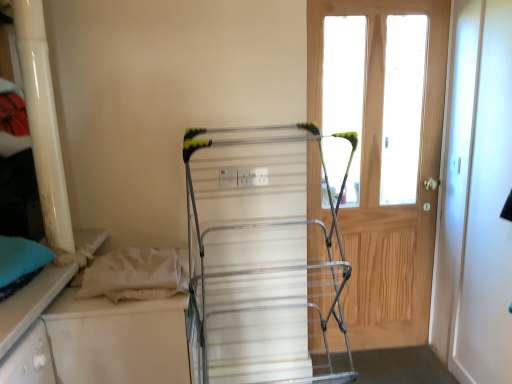
Question: Is light brown wooden door at right in front of or behind silver metallic drying rack at center in the image?

Choices:
 (A) behind
 (B) front

Answer: (A)

Question: Considering the positions of light brown wooden door at right and silver metallic drying rack at center in the image, is light brown wooden door at right taller or shorter than silver metallic drying rack at center?

Choices:
 (A) short
 (B) tall

Answer: (B)

Question: Visually, is light brown wooden door at right positioned to the left or to the right of silver metallic drying rack at center?

Choices:
 (A) left
 (B) right

Answer: (B)

Question: In the image, is silver metallic drying rack at center on the left side or the right side of light brown wooden door at right?

Choices:
 (A) right
 (B) left

Answer: (B)

Question: From a real-world perspective, relative to light brown wooden door at right, is silver metallic drying rack at center vertically above or below?

Choices:
 (A) above
 (B) below

Answer: (B)

Question: In the image, is silver metallic drying rack at center positioned in front of or behind light brown wooden door at right?

Choices:
 (A) behind
 (B) front

Answer: (B)

Question: Considering the positions of silver metallic drying rack at center and light brown wooden door at right in the image, is silver metallic drying rack at center taller or shorter than light brown wooden door at right?

Choices:
 (A) short
 (B) tall

Answer: (A)